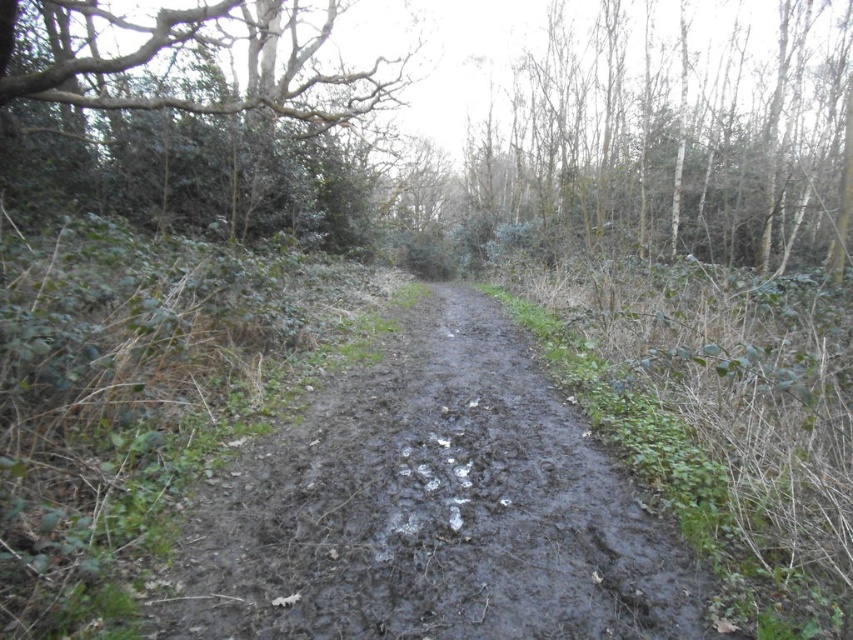
You are hiking along the narrow muddy path through the dense woodland. You see two points marked on your map. One is at point (x=611, y=492) and the other at point (x=628, y=148). If you are facing the direction of your hike, which point is closer to you?

Point (x=611, y=492) is in front of point (x=628, y=148), so the point (x=611, y=492) is closer to you when facing the direction of your hike.

You are a hiker trying to navigate the narrow muddy path through the woodland. You notice the bare branches at upper right and the green leafy tree at upper left in your view. Which of these two trees is positioned higher up in your field of view?

The bare branches at upper right is located above the green leafy tree at upper left, so it is positioned higher up in your field of view.